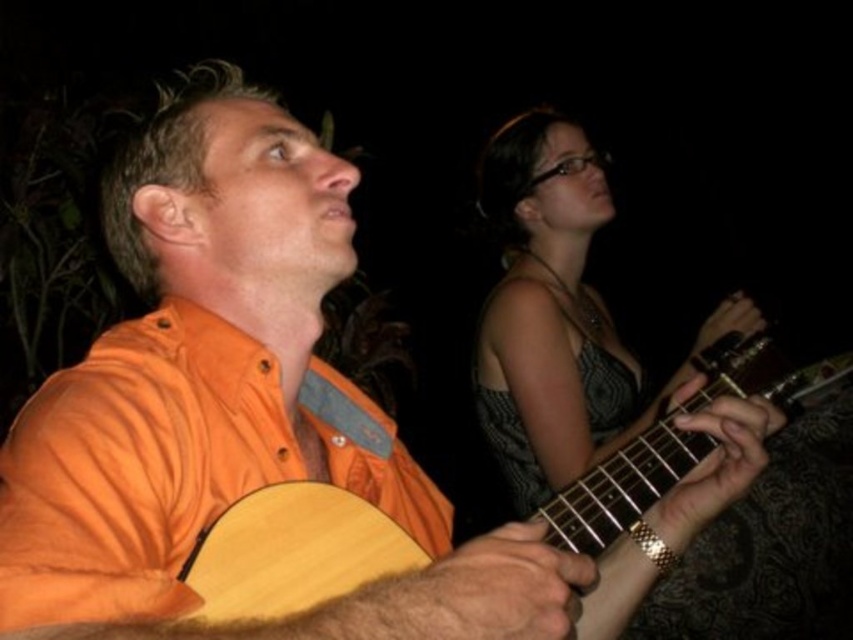
What is the color of the dress at the point located at coordinates [560,314]?

The point at coordinates [560,314] is on the matte gray dress at upper right, so the color is matte gray.

You are a photographer setting up a shot for a music performance. You have a matte gray dress at upper right and a wooden acoustic guitar at center in your frame. Which object should you adjust to ensure both fit within the camera frame? Explain your reasoning.

The matte gray dress at upper right is larger in size compared to the wooden acoustic guitar at center. Since the dress takes up more space, you should adjust its position to ensure both objects fit within the camera frame.

Consider the image. You are a photographer setting up a shot for a music performance. You have a matte gray dress at upper right and a wooden acoustic guitar at center in your frame. Which object is narrower?

The matte gray dress at upper right is narrower than the wooden acoustic guitar at center.